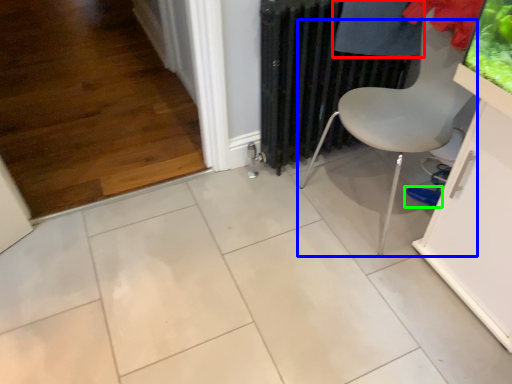
Question: Considering the real-world distances, which object is farthest from clothing (highlighted by a red box)? chair (highlighted by a blue box) or footwear (highlighted by a green box)?

Choices:
 (A) chair
 (B) footwear

Answer: (B)